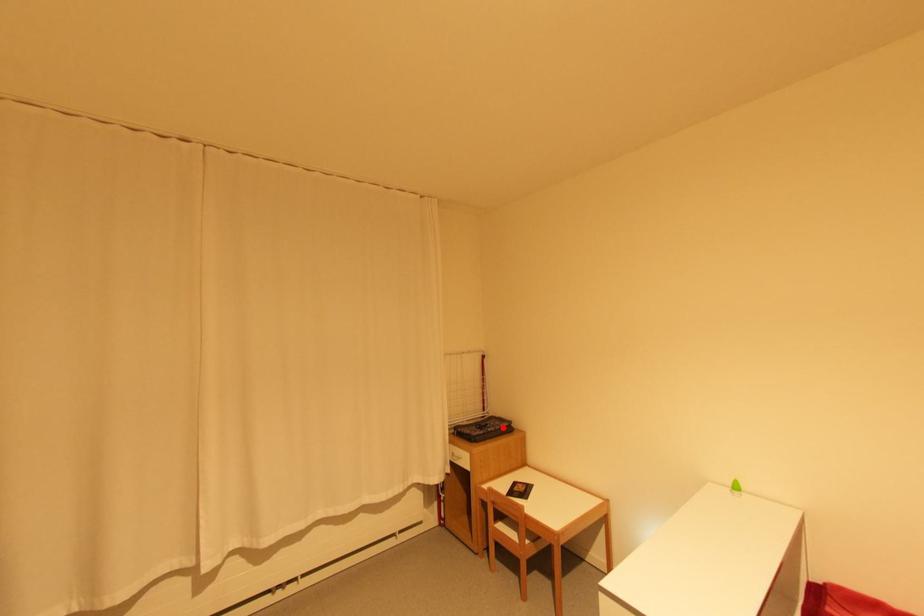
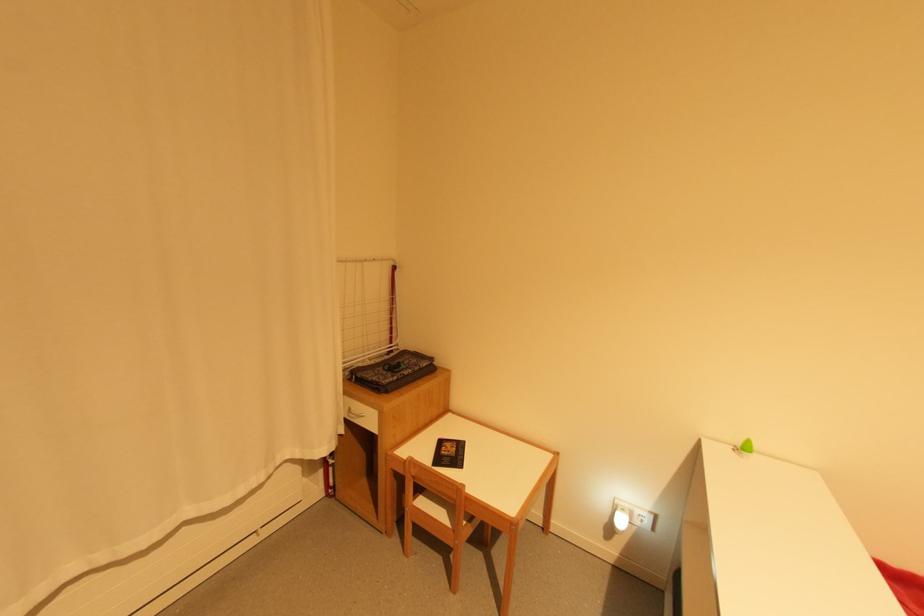
Locate, in the second image, the point that corresponds to the highlighted location in the first image.

(421, 369)